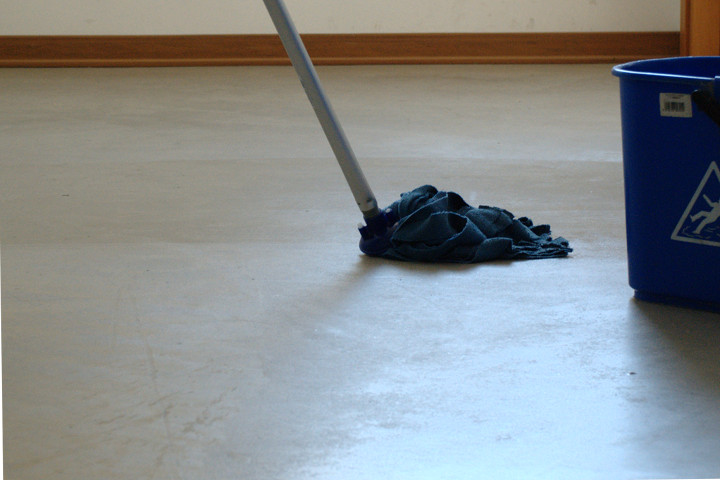
In order to click on mop handle in this screenshot , I will do `click(322, 106)`.